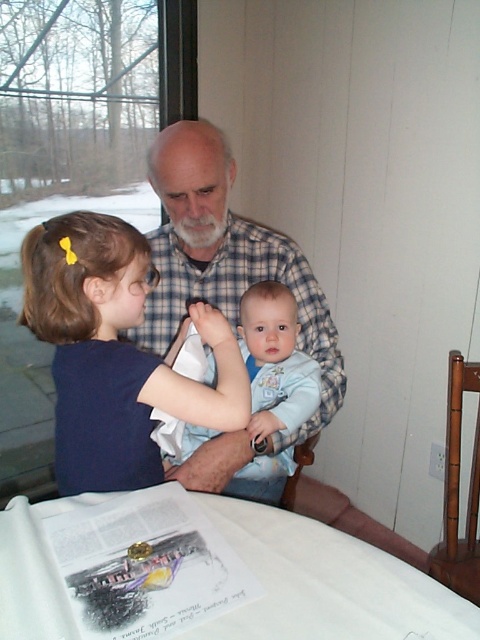
You are a tailor who needs to determine which item is wider between the matte blue shirt at left and the light blue soft fabric baby at center. Based on the scene, which one has a greater width?

The matte blue shirt at left has a greater width than the light blue soft fabric baby at center according to the description provided.